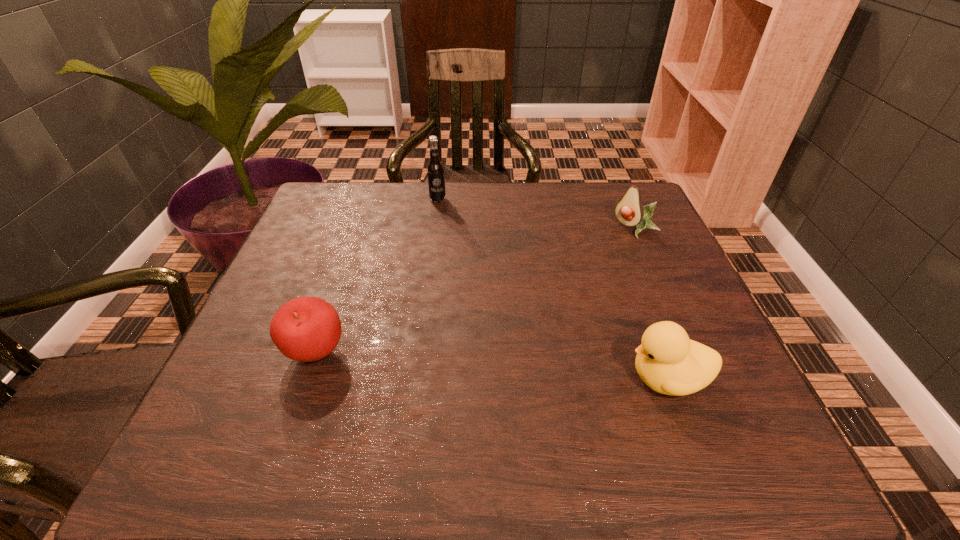
Find the location of a particular element. free region located on the label of the root beer is located at coordinates (454, 239).

Where is `free point located on the label of the root beer`? The height and width of the screenshot is (540, 960). free point located on the label of the root beer is located at coordinates (448, 226).

You are a GUI agent. You are given a task and a screenshot of the screen. Output one action in this format:
    pyautogui.click(x=<x>, y=<y>)
    Task: Click on the vacant space located on the seed side of the avocado
    The image size is (960, 540).
    Given the screenshot: What is the action you would take?
    pyautogui.click(x=570, y=285)

Image resolution: width=960 pixels, height=540 pixels. Identify the location of free spot located on the seed side of the avocado. (575, 280).

The height and width of the screenshot is (540, 960). In order to click on blank area located on the seed side of the avocado in this screenshot , I will do `click(606, 253)`.

The image size is (960, 540). What are the coordinates of `root beer that is at the far edge` in the screenshot? It's located at tap(435, 170).

Locate an element on the screen. This screenshot has width=960, height=540. avocado that is positioned at the far edge is located at coordinates (629, 211).

You are a GUI agent. You are given a task and a screenshot of the screen. Output one action in this format:
    pyautogui.click(x=<x>, y=<y>)
    Task: Click on the apple present at the near edge
    This screenshot has width=960, height=540.
    Given the screenshot: What is the action you would take?
    pyautogui.click(x=306, y=329)

Find the location of a particular element. duck situated at the near edge is located at coordinates coord(667,361).

Locate an element on the screen. Image resolution: width=960 pixels, height=540 pixels. object positioned at the left edge is located at coordinates (306, 329).